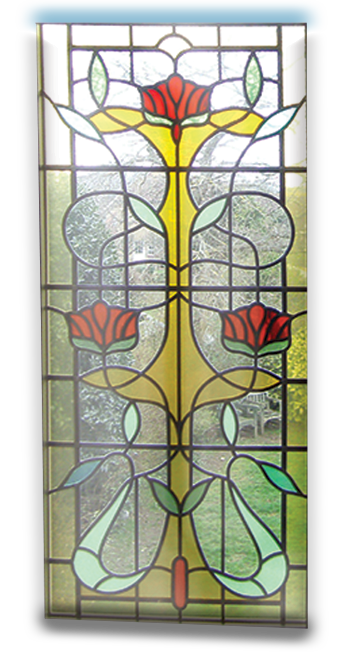
Identify the location of bottom front right corner of art. The image size is (347, 662). (46, 612).